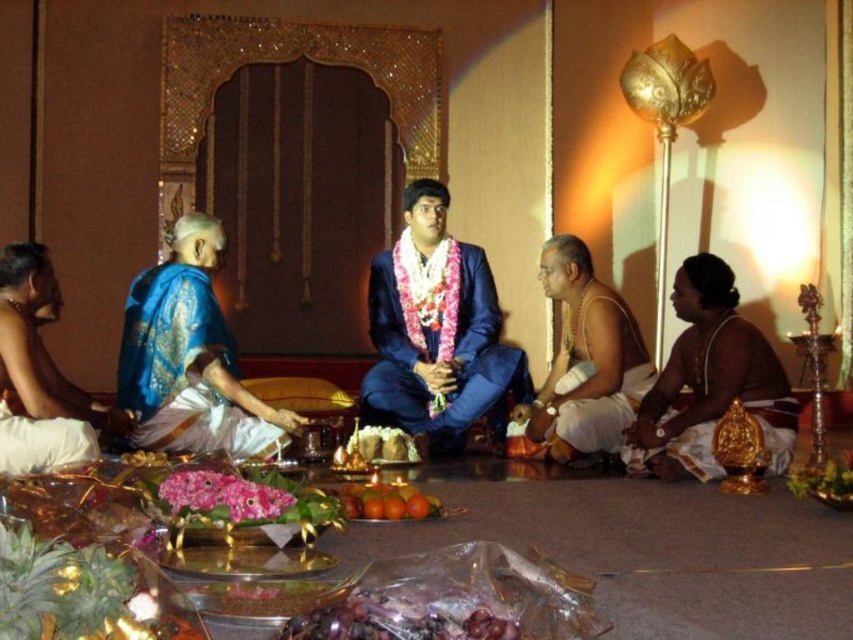
Can you confirm if blue silk saree at left is bigger than orange matte at center?

Yes.

What do you see at coordinates (190, 356) in the screenshot?
I see `blue silk saree at left` at bounding box center [190, 356].

You are a GUI agent. You are given a task and a screenshot of the screen. Output one action in this format:
    pyautogui.click(x=<x>, y=<y>)
    Task: Click on the blue silk saree at left
    This screenshot has height=640, width=853.
    Given the screenshot: What is the action you would take?
    click(190, 356)

Is brown silk dhoti at right positioned in front of orange matte at center?

That is False.

Who is taller, brown silk dhoti at right or orange matte at center?

brown silk dhoti at right

What do you see at coordinates (711, 381) in the screenshot? I see `brown silk dhoti at right` at bounding box center [711, 381].

This screenshot has width=853, height=640. What are the coordinates of `brown silk dhoti at right` in the screenshot? It's located at (711, 381).

Is blue satin suit at center to the left of shiny plastic grapes at center from the viewer's perspective?

In fact, blue satin suit at center is to the right of shiny plastic grapes at center.

Is blue satin suit at center positioned before shiny plastic grapes at center?

No, blue satin suit at center is behind shiny plastic grapes at center.

Is point (496, 406) positioned in front of point (346, 593)?

No, (496, 406) is behind (346, 593).

At what (x,y) coordinates should I click in order to perform the action: click on blue satin suit at center. Please return your answer as a coordinate pair (x, y). This screenshot has height=640, width=853. Looking at the image, I should click on (437, 333).